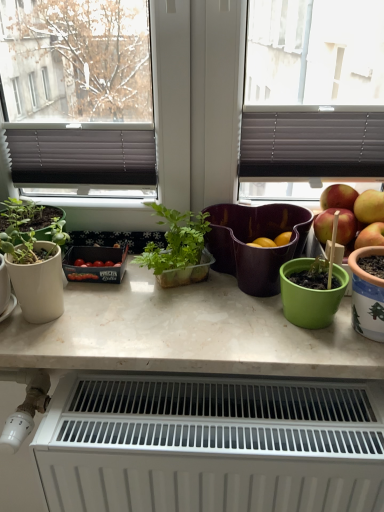
What do you see at coordinates (178, 248) in the screenshot?
I see `translucent plastic plant at center` at bounding box center [178, 248].

Image resolution: width=384 pixels, height=512 pixels. Describe the element at coordinates (211, 444) in the screenshot. I see `white matte radiator at lower center` at that location.

Locate an element on the screen. translucent plastic plant at center is located at coordinates (178, 248).

From the picture: Which object is closer to the camera taking this photo, white matte radiator at lower center or matte purple flowerpot at center, positioned as the first flowerpot in left-to-right order?

white matte radiator at lower center.

Is white matte radiator at lower center turned away from matte purple flowerpot at center, positioned as the first flowerpot in left-to-right order?

No, matte purple flowerpot at center, positioned as the first flowerpot in left-to-right order, is not at the back of white matte radiator at lower center.

From the image's perspective, which is below, white matte radiator at lower center or matte purple flowerpot at center, arranged as the first flowerpot when viewed from the back?

From the image's view, white matte radiator at lower center is below.

From the picture: Is white matte radiator at lower center wider or thinner than matte purple flowerpot at center, positioned as the first flowerpot in left-to-right order?

In the image, white matte radiator at lower center appears to be wider than matte purple flowerpot at center, positioned as the first flowerpot in left-to-right order.

Looking at this image, from a real-world perspective, between translucent plastic plant at center and white matte radiator at lower center, who is vertically higher?

translucent plastic plant at center is physically above.

From their relative heights in the image, would you say translucent plastic plant at center is taller or shorter than white matte radiator at lower center?

translucent plastic plant at center is shorter than white matte radiator at lower center.

Relative to white matte radiator at lower center, is translucent plastic plant at center in front or behind?

Clearly, translucent plastic plant at center is behind white matte radiator at lower center.

Consider the image. Which is farther from the camera, (x=202, y=234) or (x=76, y=419)?

Positioned behind is point (x=202, y=234).

Is white matte radiator at lower center not close to translucent plastic plant at center?

white matte radiator at lower center is actually quite close to translucent plastic plant at center.

From the image's perspective, between white matte radiator at lower center and translucent plastic plant at center, who is located below?

white matte radiator at lower center appears lower in the image.

Is white matte radiator at lower center oriented away from translucent plastic plant at center?

No, translucent plastic plant at center is not at the back of white matte radiator at lower center.

Considering the relative sizes of white matte radiator at lower center and translucent plastic plant at center in the image provided, is white matte radiator at lower center wider than translucent plastic plant at center?

Yes, white matte radiator at lower center is wider than translucent plastic plant at center.

Considering the positions of objects translucent plastic plant at center and matte purple flowerpot at center, arranged as the first flowerpot when viewed from the back, in the image provided, who is in front, translucent plastic plant at center or matte purple flowerpot at center, arranged as the first flowerpot when viewed from the back,?

Positioned in front is translucent plastic plant at center.

In the image, is translucent plastic plant at center on the left side or the right side of matte purple flowerpot at center, arranged as the second flowerpot when viewed from the front?

From the image, it's evident that translucent plastic plant at center is to the left of matte purple flowerpot at center, arranged as the second flowerpot when viewed from the front.

Considering the relative sizes of translucent plastic plant at center and matte purple flowerpot at center, arranged as the first flowerpot when viewed from the back, in the image provided, is translucent plastic plant at center taller than matte purple flowerpot at center, arranged as the first flowerpot when viewed from the back,?

Indeed, translucent plastic plant at center has a greater height compared to matte purple flowerpot at center, arranged as the first flowerpot when viewed from the back.

From the image's perspective, is translucent plastic plant at center above or below matte purple flowerpot at center, arranged as the second flowerpot when viewed from the front?

Clearly, from the image's perspective, translucent plastic plant at center is above matte purple flowerpot at center, arranged as the second flowerpot when viewed from the front.

Measure the distance from white matte radiator at lower center to white ceramic pot at right, which is the second flowerpot from back to front.

white matte radiator at lower center is 12.92 inches away from white ceramic pot at right, which is the second flowerpot from back to front.

Which object is positioned more to the left, white matte radiator at lower center or white ceramic pot at right, which is the second flowerpot from back to front?

white matte radiator at lower center is more to the left.

Locate an element on the screen. radiator that is under the white ceramic pot at right, arranged as the 2th flowerpot when viewed from the left (from a real-world perspective) is located at coordinates (211, 444).

How different are the orientations of white matte radiator at lower center and white ceramic pot at right, which is the second flowerpot from back to front, in degrees?

white matte radiator at lower center and white ceramic pot at right, which is the second flowerpot from back to front, are facing 1.32 degrees away from each other.

Which is further, (291, 383) or (209, 296)?

The point (209, 296) is behind.

From the picture: How much distance is there between white matte radiator at lower center and white marble countertop at center?

white matte radiator at lower center and white marble countertop at center are 4.70 inches apart.

Consider the image. Can you confirm if white matte radiator at lower center is taller than white marble countertop at center?

Yes, white matte radiator at lower center is taller than white marble countertop at center.

From the image's perspective, which object appears higher, white matte radiator at lower center or white marble countertop at center?

white marble countertop at center, from the image's perspective.

Would you say white ceramic pot at right, which is the second flowerpot from back to front, is part of translucent plastic plant at center's contents?

Definitely not — white ceramic pot at right, which is the second flowerpot from back to front, is not inside translucent plastic plant at center.

Could you measure the distance between translucent plastic plant at center and white ceramic pot at right, marked as the 1th flowerpot in a right-to-left arrangement?

translucent plastic plant at center is 13.84 inches away from white ceramic pot at right, marked as the 1th flowerpot in a right-to-left arrangement.

From a real-world perspective, is translucent plastic plant at center beneath white ceramic pot at right, arranged as the 2th flowerpot when viewed from the left?

Actually, translucent plastic plant at center is physically above white ceramic pot at right, arranged as the 2th flowerpot when viewed from the left, in the real world.

Where is `radiator in front of the matte purple flowerpot at center, the 2th flowerpot in the right-to-left sequence`? Image resolution: width=384 pixels, height=512 pixels. radiator in front of the matte purple flowerpot at center, the 2th flowerpot in the right-to-left sequence is located at coordinates (211, 444).

Where is `radiator on the right of translucent plastic plant at center`? The image size is (384, 512). radiator on the right of translucent plastic plant at center is located at coordinates (211, 444).

Which object lies further to the anchor point matte purple flowerpot at center, arranged as the second flowerpot when viewed from the front, white ceramic pot at right, which is the second flowerpot from back to front, or translucent plastic plant at center?

The object further to matte purple flowerpot at center, arranged as the second flowerpot when viewed from the front, is white ceramic pot at right, which is the second flowerpot from back to front.

Based on the photo, based on their spatial positions, is translucent plastic plant at center or white marble countertop at center closer to white matte radiator at lower center?

Based on the image, white marble countertop at center appears to be nearer to white matte radiator at lower center.

Which object lies further to the anchor point white ceramic pot at right, arranged as the 2th flowerpot when viewed from the left, white marble countertop at center or translucent plastic plant at center?

translucent plastic plant at center is further to white ceramic pot at right, arranged as the 2th flowerpot when viewed from the left.

From the image, which object appears to be farther from white ceramic pot at right, arranged as the 2th flowerpot when viewed from the left, translucent plastic plant at center or matte purple flowerpot at center, positioned as the first flowerpot in left-to-right order?

translucent plastic plant at center is positioned further to the anchor white ceramic pot at right, arranged as the 2th flowerpot when viewed from the left.

Looking at the image, which one is located further to matte purple flowerpot at center, the 2th flowerpot in the right-to-left sequence, white matte radiator at lower center or translucent plastic plant at center?

Among the two, white matte radiator at lower center is located further to matte purple flowerpot at center, the 2th flowerpot in the right-to-left sequence.

Estimate the real-world distances between objects in this image. Which object is closer to white marble countertop at center, white ceramic pot at right, acting as the 1th flowerpot starting from the front, or translucent plastic plant at center?

The object closer to white marble countertop at center is translucent plastic plant at center.

When comparing their distances from translucent plastic plant at center, does white marble countertop at center or white ceramic pot at right, arranged as the 2th flowerpot when viewed from the left, seem closer?

The object closer to translucent plastic plant at center is white marble countertop at center.

When comparing their distances from white matte radiator at lower center, does translucent plastic plant at center or white ceramic pot at right, which is the second flowerpot from back to front, seem further?

Among the two, translucent plastic plant at center is located further to white matte radiator at lower center.

Find the location of a particular element. countertop between matte purple flowerpot at center, positioned as the first flowerpot in left-to-right order, and white matte radiator at lower center, in the vertical direction is located at coordinates (186, 333).

Locate an element on the screen. Image resolution: width=384 pixels, height=512 pixels. countertop located between translucent plastic plant at center and white ceramic pot at right, which is the second flowerpot from back to front, in the left-right direction is located at coordinates (186, 333).

Image resolution: width=384 pixels, height=512 pixels. Identify the location of countertop that lies between translucent plastic plant at center and white matte radiator at lower center from top to bottom. (186, 333).

Image resolution: width=384 pixels, height=512 pixels. Find the location of `countertop between white ceramic pot at right, arranged as the 2th flowerpot when viewed from the left, and white matte radiator at lower center vertically`. countertop between white ceramic pot at right, arranged as the 2th flowerpot when viewed from the left, and white matte radiator at lower center vertically is located at coordinates (186, 333).